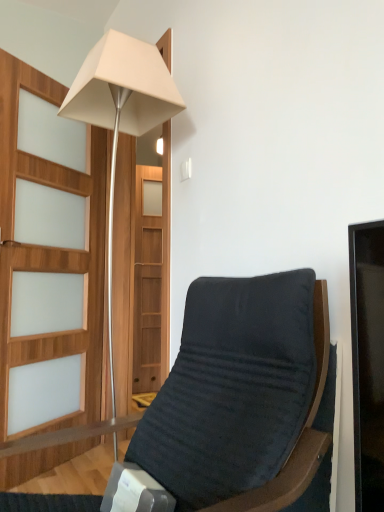
Question: Should I look upward or downward to see velvet-like dark gray chair at center?

Choices:
 (A) up
 (B) down

Answer: (B)

Question: Is velvet-like dark gray chair at center facing away from matte white lamp at upper left?

Choices:
 (A) no
 (B) yes

Answer: (A)

Question: From a real-world perspective, is velvet-like dark gray chair at center located beneath matte white lamp at upper left?

Choices:
 (A) yes
 (B) no

Answer: (A)

Question: From the image's perspective, is velvet-like dark gray chair at center below matte white lamp at upper left?

Choices:
 (A) yes
 (B) no

Answer: (A)

Question: Is velvet-like dark gray chair at center aimed at matte white lamp at upper left?

Choices:
 (A) no
 (B) yes

Answer: (A)

Question: Are velvet-like dark gray chair at center and matte white lamp at upper left beside each other?

Choices:
 (A) yes
 (B) no

Answer: (B)

Question: Can you confirm if velvet-like dark gray chair at center is positioned to the left of matte white lamp at upper left?

Choices:
 (A) no
 (B) yes

Answer: (A)

Question: Is matte white lamp at upper left facing towards velvet-like dark gray chair at center?

Choices:
 (A) no
 (B) yes

Answer: (A)

Question: Is matte white lamp at upper left bigger than velvet-like dark gray chair at center?

Choices:
 (A) yes
 (B) no

Answer: (B)

Question: Could velvet-like dark gray chair at center be considered to be inside matte white lamp at upper left?

Choices:
 (A) no
 (B) yes

Answer: (A)

Question: From the image's perspective, is matte white lamp at upper left above velvet-like dark gray chair at center?

Choices:
 (A) no
 (B) yes

Answer: (B)

Question: Is matte white lamp at upper left oriented away from velvet-like dark gray chair at center?

Choices:
 (A) yes
 (B) no

Answer: (B)

Question: Can you confirm if matte white lamp at upper left is wider than velvet-like dark gray chair at center?

Choices:
 (A) no
 (B) yes

Answer: (A)

Question: In the image, is velvet-like dark gray chair at center on the left side or the right side of matte white lamp at upper left?

Choices:
 (A) left
 (B) right

Answer: (B)